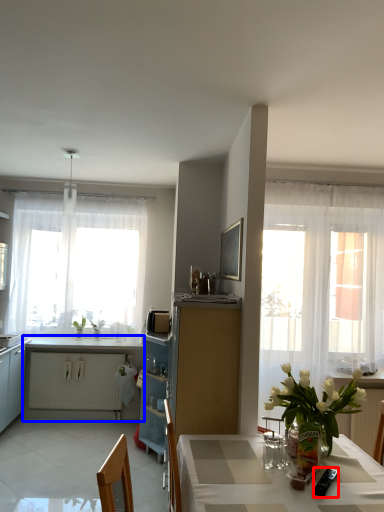
Question: Which object appears farthest to the camera in this image, appliance (highlighted by a red box) or cabinetry (highlighted by a blue box)?

Choices:
 (A) appliance
 (B) cabinetry

Answer: (B)